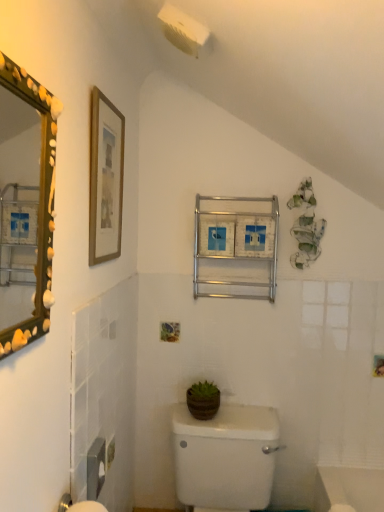
Question: Can you confirm if wooden framed print at upper left is taller than green matte pot at center?

Choices:
 (A) yes
 (B) no

Answer: (A)

Question: Is wooden framed print at upper left behind green matte pot at center?

Choices:
 (A) yes
 (B) no

Answer: (B)

Question: Considering the relative sizes of wooden framed print at upper left and green matte pot at center in the image provided, is wooden framed print at upper left thinner than green matte pot at center?

Choices:
 (A) no
 (B) yes

Answer: (B)

Question: Is wooden framed print at upper left turned away from green matte pot at center?

Choices:
 (A) yes
 (B) no

Answer: (B)

Question: Is wooden framed print at upper left at the right side of green matte pot at center?

Choices:
 (A) no
 (B) yes

Answer: (A)

Question: Considering the positions of point (175, 445) and point (210, 397), is point (175, 445) closer or farther from the camera than point (210, 397)?

Choices:
 (A) farther
 (B) closer

Answer: (A)

Question: Is white glossy toilet at center in front of or behind green matte pot at center in the image?

Choices:
 (A) front
 (B) behind

Answer: (A)

Question: Looking at the image, does white glossy toilet at center seem bigger or smaller compared to green matte pot at center?

Choices:
 (A) big
 (B) small

Answer: (A)

Question: Which is correct: white glossy toilet at center is inside green matte pot at center, or outside of it?

Choices:
 (A) outside
 (B) inside

Answer: (A)

Question: Is green matte pot at center in front of or behind white glossy toilet at center in the image?

Choices:
 (A) behind
 (B) front

Answer: (A)

Question: From the image's perspective, relative to white glossy toilet at center, is green matte pot at center above or below?

Choices:
 (A) above
 (B) below

Answer: (A)

Question: Considering the positions of green matte pot at center and white glossy toilet at center in the image, is green matte pot at center bigger or smaller than white glossy toilet at center?

Choices:
 (A) small
 (B) big

Answer: (A)

Question: From a real-world perspective, is green matte pot at center physically located above or below white glossy toilet at center?

Choices:
 (A) below
 (B) above

Answer: (B)

Question: Does point (102, 99) appear closer or farther from the camera than point (208, 418)?

Choices:
 (A) closer
 (B) farther

Answer: (A)

Question: From the image's perspective, relative to green matte pot at center, is wooden framed print at upper left above or below?

Choices:
 (A) below
 (B) above

Answer: (B)